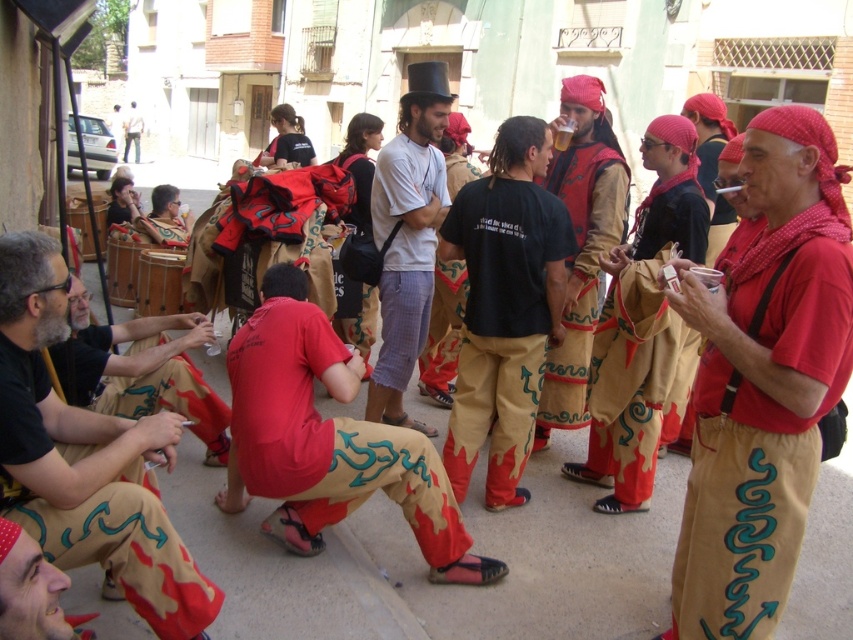
You are a GUI agent. You are given a task and a screenshot of the screen. Output one action in this format:
    pyautogui.click(x=<x>, y=<y>)
    Task: Click on the matte khaki pants at lower left
    This screenshot has width=853, height=640.
    Given the screenshot: What is the action you would take?
    pyautogui.click(x=86, y=458)

Who is positioned more to the right, matte khaki pants at lower left or white cotton shirt at center?

Positioned to the right is white cotton shirt at center.

Where is `matte khaki pants at lower left`? The image size is (853, 640). matte khaki pants at lower left is located at coordinates (86, 458).

Locate an element on the screen. matte khaki pants at lower left is located at coordinates (86, 458).

Between point (15, 492) and point (531, 214), which one is positioned in front?

Point (15, 492)

Is matte khaki pants at lower left below black cotton t-shirt at center?

Indeed, matte khaki pants at lower left is positioned under black cotton t-shirt at center.

Image resolution: width=853 pixels, height=640 pixels. What do you see at coordinates (86, 458) in the screenshot?
I see `matte khaki pants at lower left` at bounding box center [86, 458].

Locate an element on the screen. matte khaki pants at lower left is located at coordinates (86, 458).

From the picture: Does red cotton pants at center have a smaller size compared to matte red shirt at lower left?

Incorrect, red cotton pants at center is not smaller in size than matte red shirt at lower left.

Can you confirm if red cotton pants at center is wider than matte red shirt at lower left?

Yes.

Which is in front, point (267, 484) or point (53, 349)?

Point (53, 349)

This screenshot has width=853, height=640. What are the coordinates of `red cotton pants at center` in the screenshot? It's located at (328, 438).